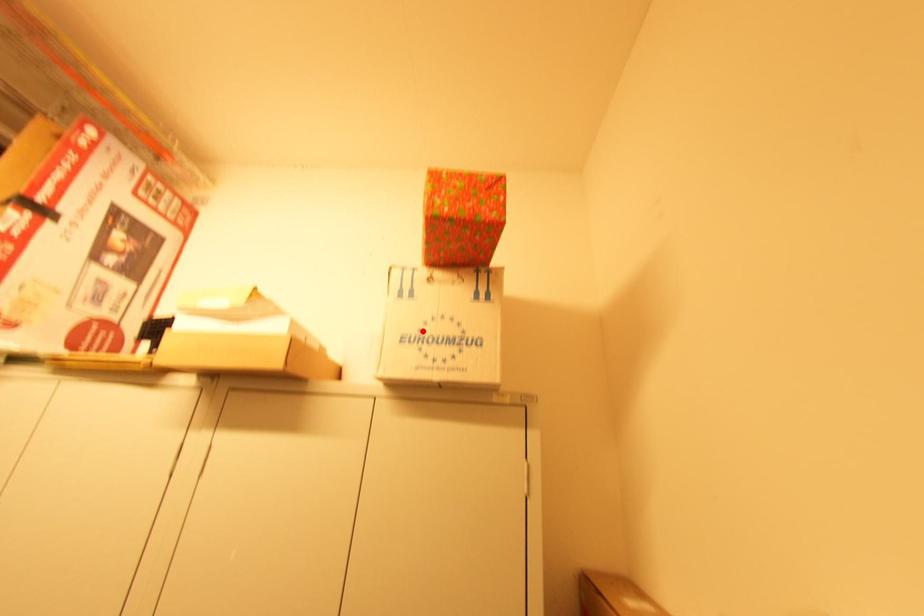
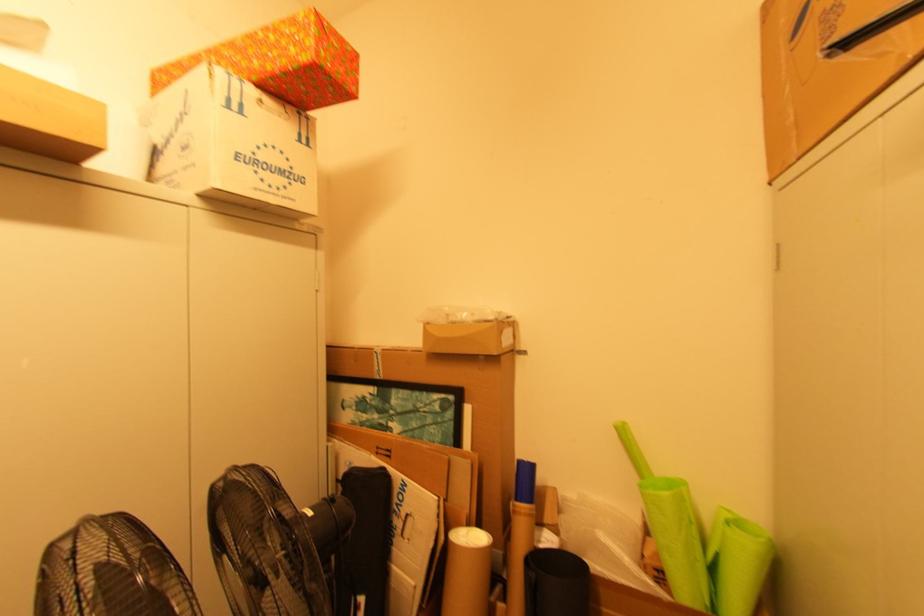
Find the pixel in the second image that matches the highlighted location in the first image.

(257, 154)